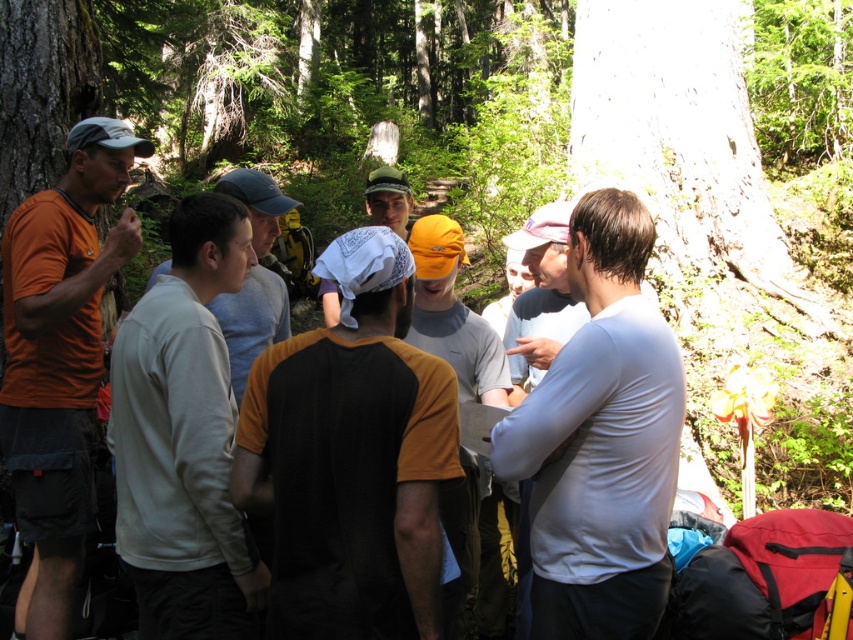
Question: Does black jersey at center lie behind white fleece shirt at center?

Choices:
 (A) yes
 (B) no

Answer: (B)

Question: Can you confirm if white smooth shirt at center is smaller than gray cotton shirt at center?

Choices:
 (A) yes
 (B) no

Answer: (A)

Question: Considering the real-world distances, which object is farthest from the orange fabric cap at center?

Choices:
 (A) black jersey at center
 (B) matte orange t-shirt at left
 (C) gray cotton shirt at center
 (D) white fleece shirt at center

Answer: (B)

Question: Which is nearer to the orange fabric cap at center?

Choices:
 (A) white fleece shirt at center
 (B) white smooth shirt at center
 (C) black jersey at center
 (D) matte orange t-shirt at left

Answer: (C)

Question: Is white fleece shirt at center bigger than matte orange t-shirt at left?

Choices:
 (A) yes
 (B) no

Answer: (B)

Question: Which object is farther from the camera taking this photo?

Choices:
 (A) white smooth shirt at center
 (B) orange fabric cap at center

Answer: (B)